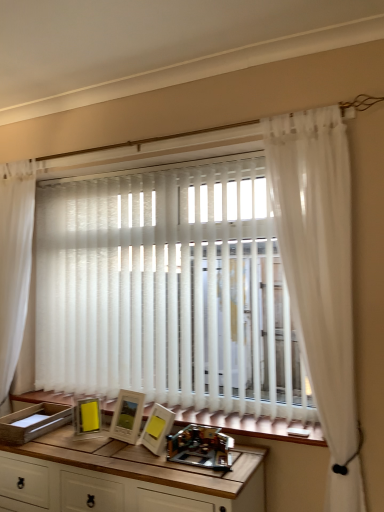
Where is `free space in front of metallic plastic toy at center`? free space in front of metallic plastic toy at center is located at coordinates (204, 476).